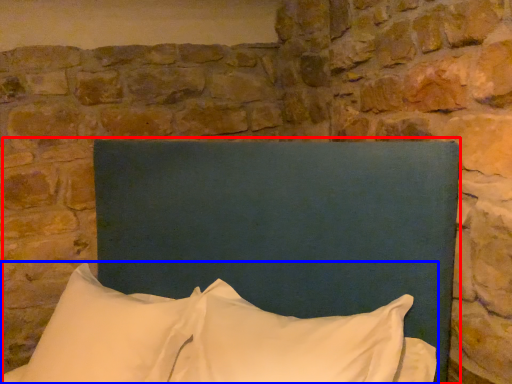
Question: Which object appears closest to the camera in this image, bed (highlighted by a red box) or pillow (highlighted by a blue box)?

Choices:
 (A) bed
 (B) pillow

Answer: (A)